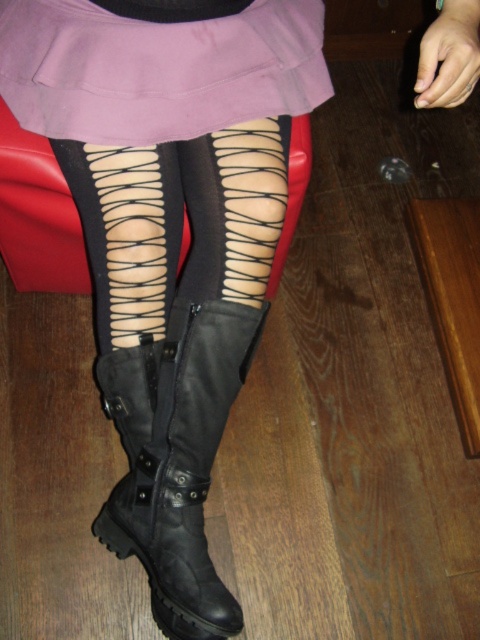
Question: Does black leather boots at lower center have a greater width compared to matte purple skirt at upper center?

Choices:
 (A) no
 (B) yes

Answer: (A)

Question: Which object is farther from the camera taking this photo?

Choices:
 (A) black leather boots at lower center
 (B) black leather boot at lower center
 (C) matte purple skirt at upper center

Answer: (B)

Question: Can you confirm if matte purple skirt at upper center is smaller than black leather boot at lower center?

Choices:
 (A) no
 (B) yes

Answer: (B)

Question: Which point is farther from the camera taking this photo?

Choices:
 (A) (200, 49)
 (B) (118, 490)

Answer: (B)

Question: Which object is closer to the camera taking this photo?

Choices:
 (A) matte purple skirt at upper center
 (B) black leather boots at lower center

Answer: (B)

Question: Does matte purple skirt at upper center appear under black leather boot at lower center?

Choices:
 (A) yes
 (B) no

Answer: (B)